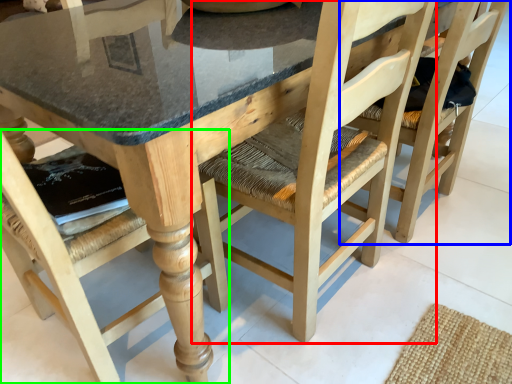
Question: Based on their relative distances, which object is farther from chair (highlighted by a red box)? Choose from chair (highlighted by a blue box) and chair (highlighted by a green box).

Choices:
 (A) chair
 (B) chair

Answer: (B)